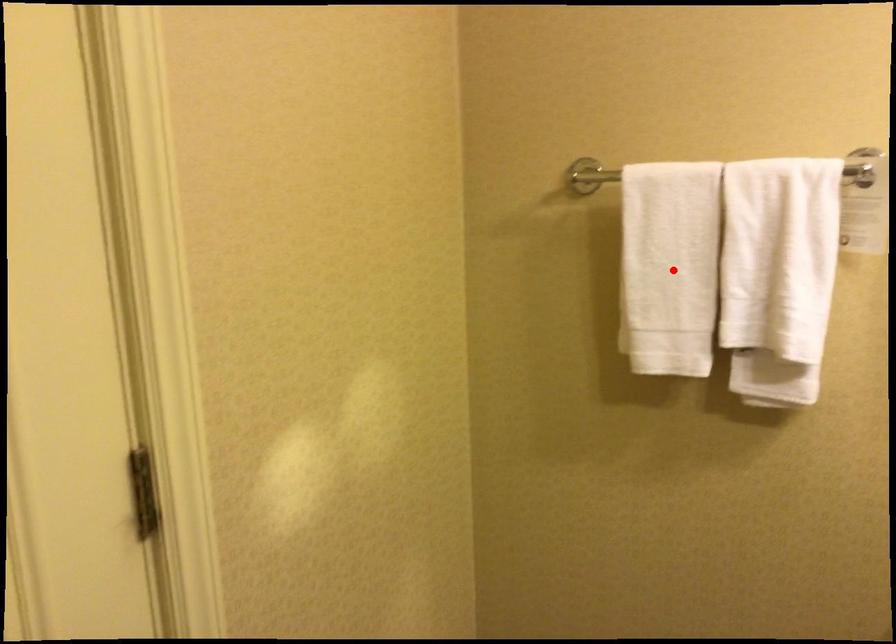
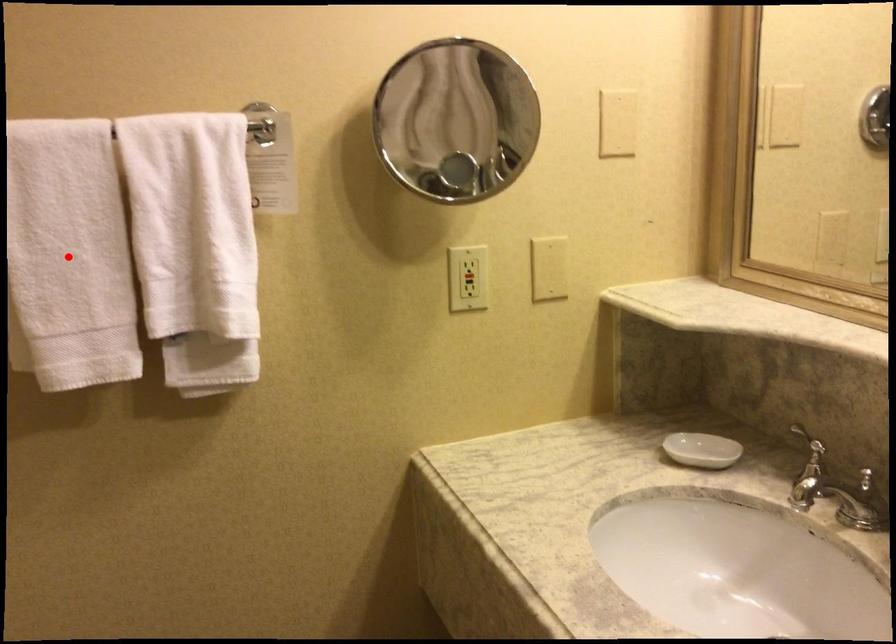
I am providing you with two images of the same scene from different viewpoints. A red point is marked on the first image and another point is marked on the second image. Is the red point in image1 aligned with the point shown in image2?

Yes